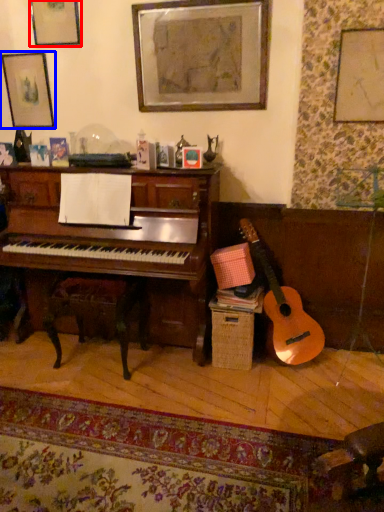
Question: Which object is further to the camera taking this photo, picture frame (highlighted by a red box) or picture frame (highlighted by a blue box)?

Choices:
 (A) picture frame
 (B) picture frame

Answer: (B)